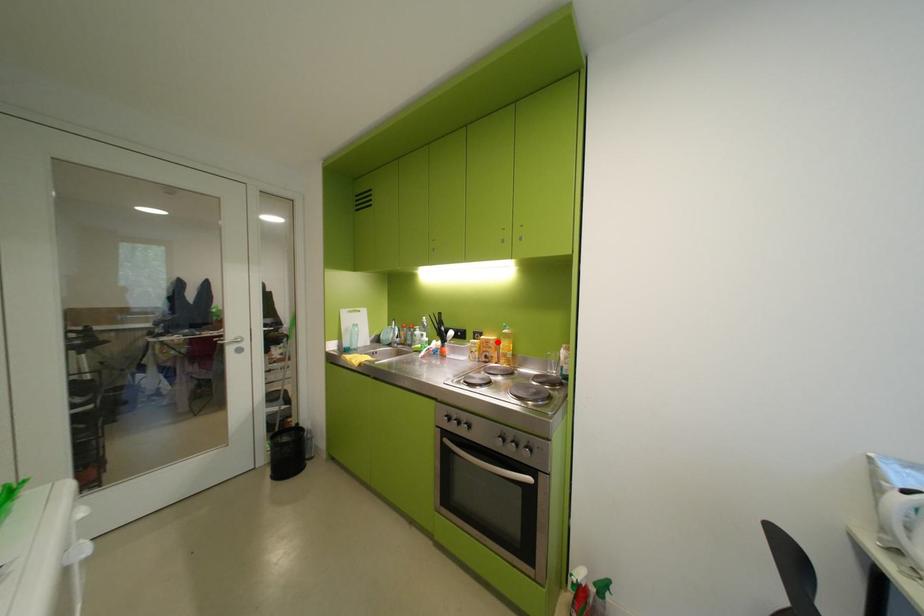
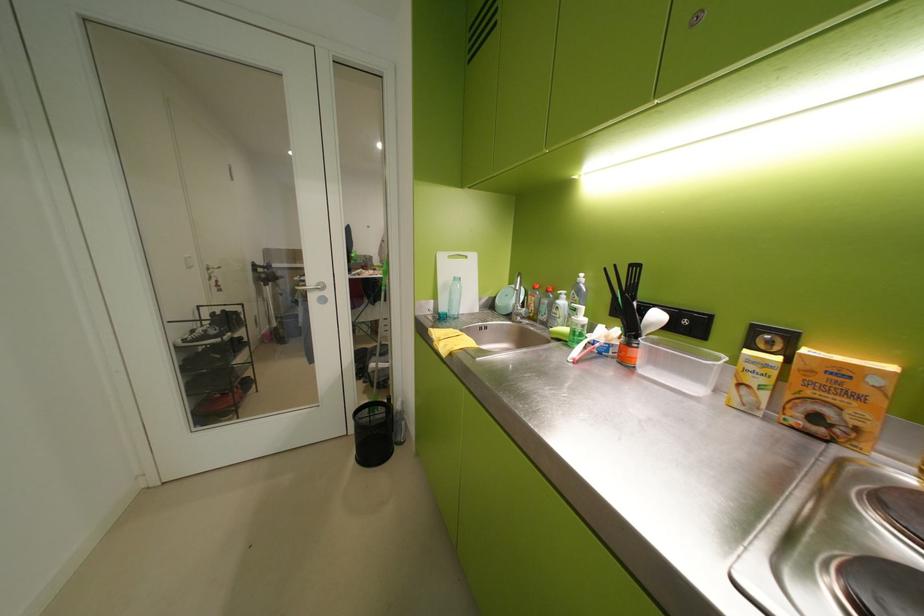
The point at the highlighted location is marked in the first image. Where is the corresponding point in the second image?

(852, 373)